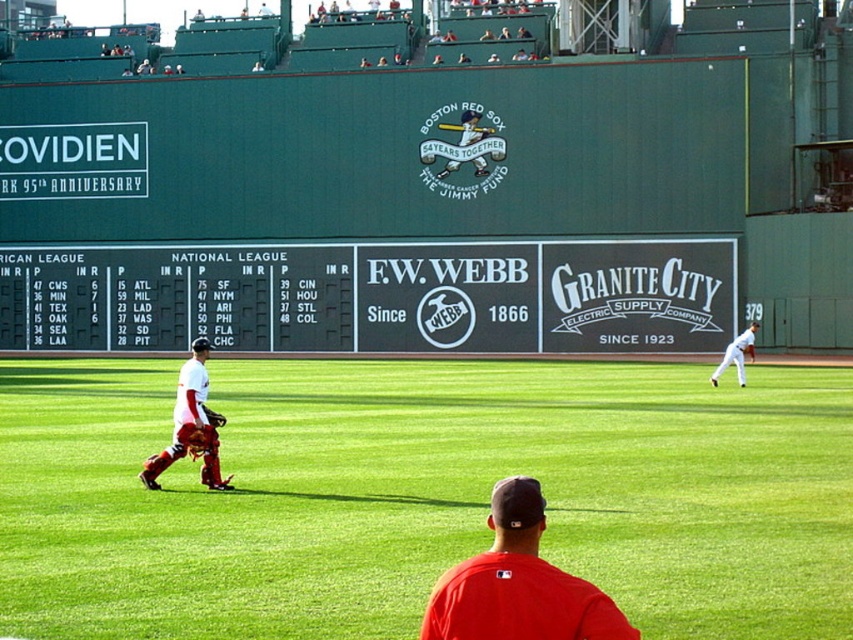
Can you confirm if red matte baseball cap at center is positioned to the right of brown leather glove at center?

Correct, you'll find red matte baseball cap at center to the right of brown leather glove at center.

How far apart are red matte baseball cap at center and brown leather glove at center?

A distance of 14.11 meters exists between red matte baseball cap at center and brown leather glove at center.

What do you see at coordinates (518, 582) in the screenshot? This screenshot has height=640, width=853. I see `red matte baseball cap at center` at bounding box center [518, 582].

This screenshot has width=853, height=640. Find the location of `red matte baseball cap at center`. red matte baseball cap at center is located at coordinates (518, 582).

Who is positioned more to the left, black matte scoreboard at center or red matte baseball cap at center?

black matte scoreboard at center is more to the left.

Between point (274, 252) and point (445, 611), which one is positioned behind?

The point (274, 252) is behind.

Find the location of a particular element. The height and width of the screenshot is (640, 853). black matte scoreboard at center is located at coordinates pos(374,296).

Consider the image. Can you confirm if green grass at center is bigger than white matte baseball player at right?

Correct, green grass at center is larger in size than white matte baseball player at right.

Is point (128, 506) farther from viewer compared to point (717, 369)?

No, (128, 506) is closer to viewer.

At what (x,y) coordinates should I click in order to perform the action: click on green grass at center. Please return your answer as a coordinate pair (x, y). Looking at the image, I should click on (421, 496).